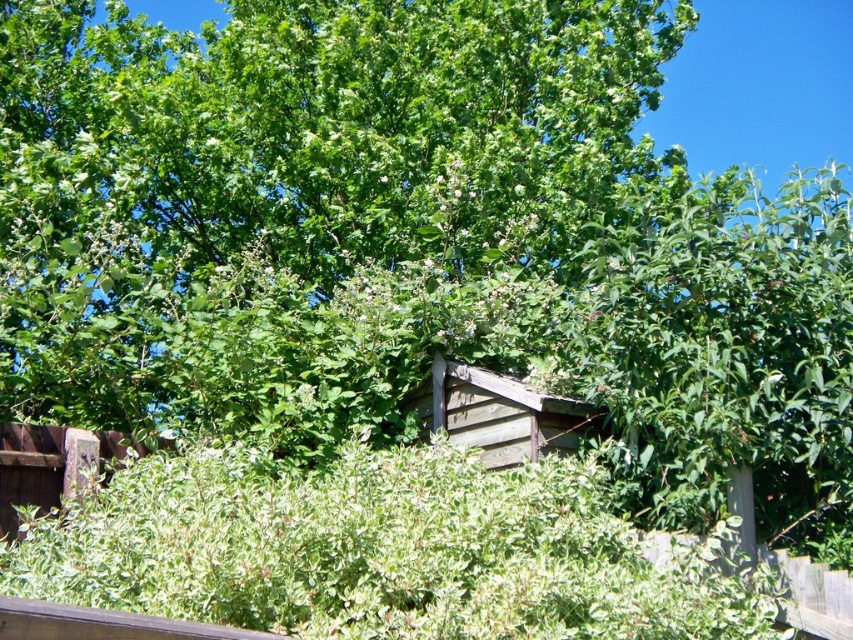
You are a gardener standing at the origin point of the garden. You need to locate the green leafy tree at center. Can you determine its exact coordinates?

The green leafy tree at center is located at coordinates point (308, 202).

You are a gardener who needs to place a 4.5 meter long fence between the green leafy tree at center and the weathered wood hut at center. Can you fit the fence between them without cutting either of them down?

The distance between the green leafy tree at center and the weathered wood hut at center is 3.93 meters. Since the fence is 4.5 meters long, which is longer than the available space, it won

You are a gardener planning to plant a new flower bed between the green leafy tree at center and the weathered wood hut at center. Considering their sizes, which object should you place closer to the flower bed to ensure enough space?

The green leafy tree at center has a smaller size compared to the weathered wood hut at center, so you should place the smaller green leafy tree at center closer to the flower bed to allow sufficient space for growth and maintenance.